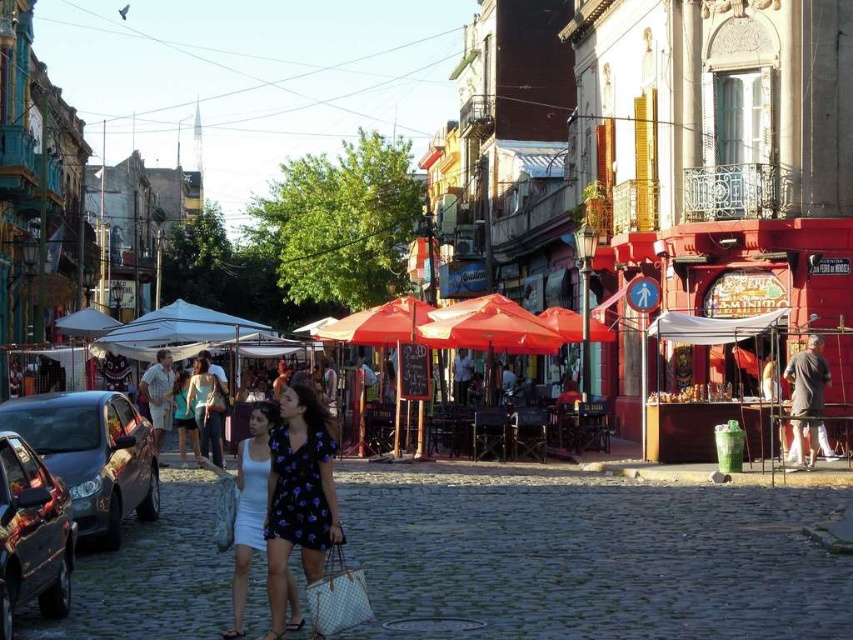
You are standing at the point marked as point (x=160, y=394) in the image. What is the color of the fabric at that location?

The point (x=160, y=394) is on light brown fabric shirt at center, so the color is light brown.

You are a photographer standing on the cobblestone street in the image. You notice two people wearing distinct clothing items. The first person is wearing dark gray fabric pants at right, and the second is wearing a matte blue dress at center. From your vantage point, which clothing item is positioned higher up in the scene?

The dark gray fabric pants at right is located above the matte blue dress at center in the scene.